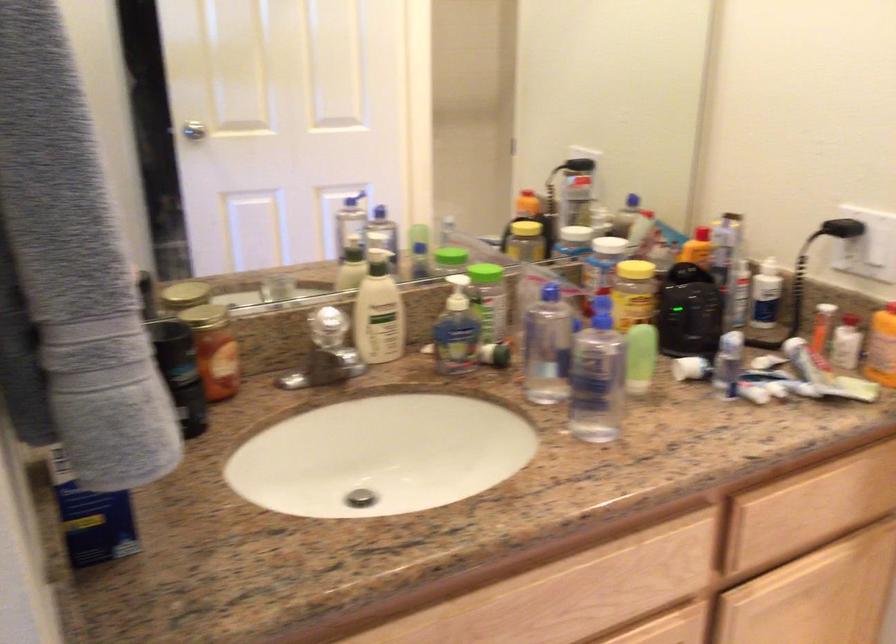
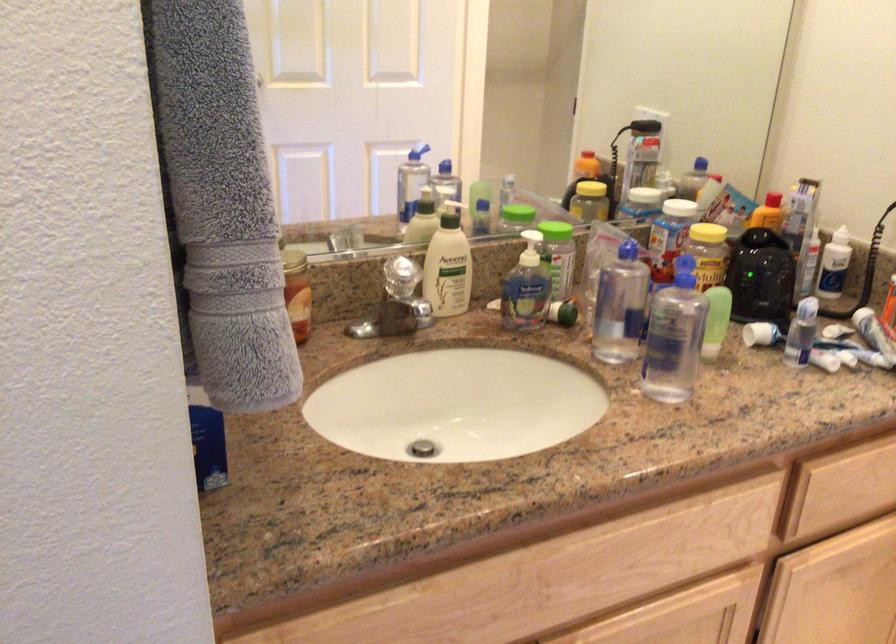
In the second image, find the point that corresponds to point 634,270 in the first image.

(707, 232)